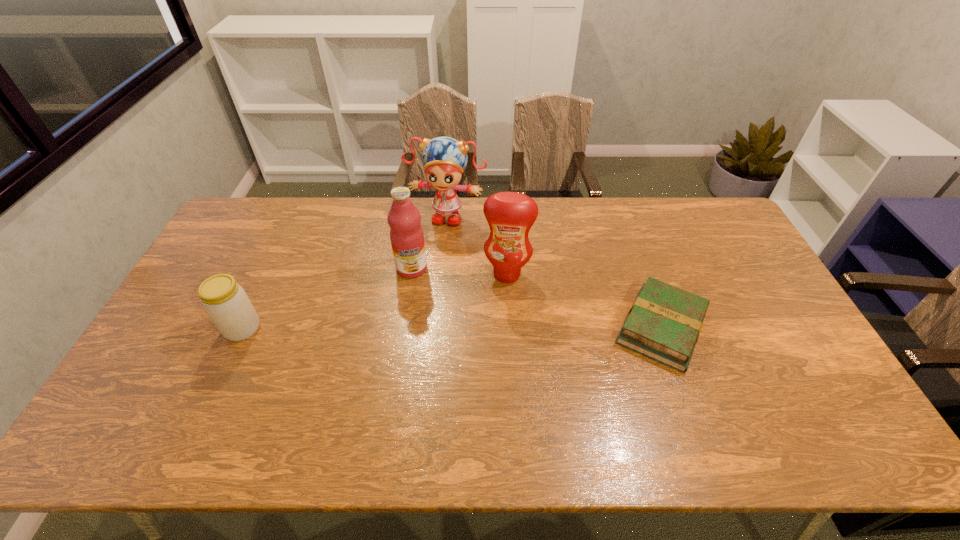
In the image, there is a desktop. Where is `vacant space at the near edge`? The width and height of the screenshot is (960, 540). vacant space at the near edge is located at coordinates (523, 395).

You are a GUI agent. You are given a task and a screenshot of the screen. Output one action in this format:
    pyautogui.click(x=<x>, y=<y>)
    Task: Click on the free space at the left edge
    Image resolution: width=960 pixels, height=540 pixels.
    Given the screenshot: What is the action you would take?
    pyautogui.click(x=188, y=298)

Where is `vacant space at the right edge of the desktop`? The height and width of the screenshot is (540, 960). vacant space at the right edge of the desktop is located at coordinates (698, 246).

What are the coordinates of `blank space at the near right corner of the desktop` in the screenshot? It's located at (804, 399).

Where is `vacant space that is in between the book and the doll`? The height and width of the screenshot is (540, 960). vacant space that is in between the book and the doll is located at coordinates (554, 271).

You are a GUI agent. You are given a task and a screenshot of the screen. Output one action in this format:
    pyautogui.click(x=<x>, y=<y>)
    Task: Click on the free point between the fruit juice and the condiment
    This screenshot has width=960, height=540.
    Given the screenshot: What is the action you would take?
    pyautogui.click(x=459, y=271)

Find the location of `free spot between the shortest object and the condiment`. free spot between the shortest object and the condiment is located at coordinates (584, 301).

The height and width of the screenshot is (540, 960). Identify the location of vacant space that is in between the fruit juice and the doll. (429, 241).

You are a GUI agent. You are given a task and a screenshot of the screen. Output one action in this format:
    pyautogui.click(x=<x>, y=<y>)
    Task: Click on the vacant region between the fruit juice and the condiment
    This screenshot has width=960, height=540.
    Given the screenshot: What is the action you would take?
    pyautogui.click(x=459, y=271)

At what (x,y) coordinates should I click in order to perform the action: click on empty space between the book and the leftmost object. Please return your answer as a coordinate pair (x, y). Looking at the image, I should click on (452, 328).